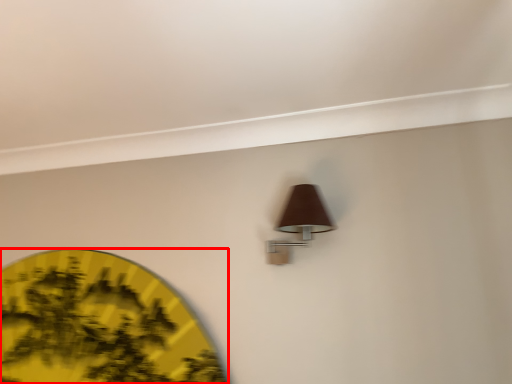
Question: Considering the relative positions of circle (annotated by the red box) and lamp in the image provided, where is circle (annotated by the red box) located with respect to the staircase?

Choices:
 (A) left
 (B) right

Answer: (A)